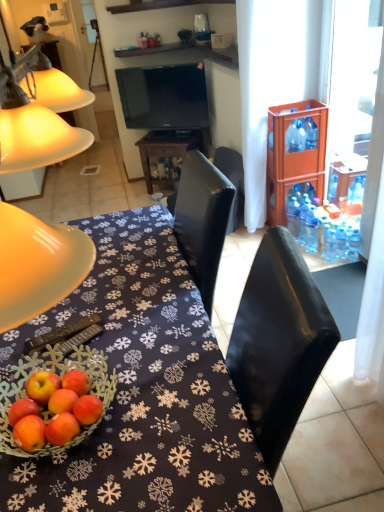
Question: Is matte yellow lampshade at left positioned behind black glossy table at center?

Choices:
 (A) no
 (B) yes

Answer: (B)

Question: Is matte yellow lampshade at left to the left of black glossy table at center from the viewer's perspective?

Choices:
 (A) no
 (B) yes

Answer: (B)

Question: Can you confirm if matte yellow lampshade at left is thinner than black glossy table at center?

Choices:
 (A) yes
 (B) no

Answer: (A)

Question: Is matte yellow lampshade at left positioned with its back to black glossy table at center?

Choices:
 (A) no
 (B) yes

Answer: (A)

Question: From a real-world perspective, is matte yellow lampshade at left on black glossy table at center?

Choices:
 (A) yes
 (B) no

Answer: (A)

Question: Is matte yellow lampshade at left outside black glossy table at center?

Choices:
 (A) no
 (B) yes

Answer: (B)

Question: Can you confirm if black leather chair at center is thinner than clear plastic bottle at right, positioned as the first bottle in left-to-right order?

Choices:
 (A) yes
 (B) no

Answer: (B)

Question: Can you confirm if black leather chair at center is positioned to the right of clear plastic bottle at right, acting as the third bottle starting from the right?

Choices:
 (A) yes
 (B) no

Answer: (B)

Question: Is black leather chair at center positioned behind clear plastic bottle at right, which appears as the 2th bottle when ordered from the bottom?

Choices:
 (A) yes
 (B) no

Answer: (B)

Question: Does black leather chair at center have a greater width compared to clear plastic bottle at right, which is the 2th bottle from top to bottom?

Choices:
 (A) yes
 (B) no

Answer: (A)

Question: Considering the relative sizes of black leather chair at center and clear plastic bottle at right, which appears as the 2th bottle when ordered from the bottom, in the image provided, is black leather chair at center smaller than clear plastic bottle at right, which appears as the 2th bottle when ordered from the bottom,?

Choices:
 (A) no
 (B) yes

Answer: (A)

Question: From the image's perspective, is black leather chair at center on top of clear plastic bottle at right, which is the 2th bottle from top to bottom?

Choices:
 (A) yes
 (B) no

Answer: (A)

Question: Is black glossy table at center in contact with clear plastic bottle at right, positioned as the first bottle in left-to-right order?

Choices:
 (A) no
 (B) yes

Answer: (A)